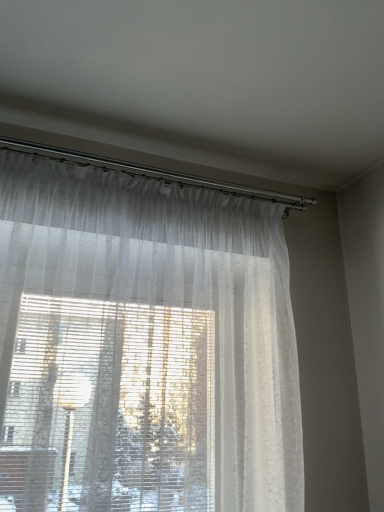
Find the location of a particular element. translucent white curtain at upper left is located at coordinates (143, 345).

What is the approximate height of translucent white curtain at upper left?

It is 1.01 meters.

This screenshot has width=384, height=512. Describe the element at coordinates (143, 345) in the screenshot. I see `translucent white curtain at upper left` at that location.

What are the coordinates of `translucent white curtain at upper left` in the screenshot? It's located at (143, 345).